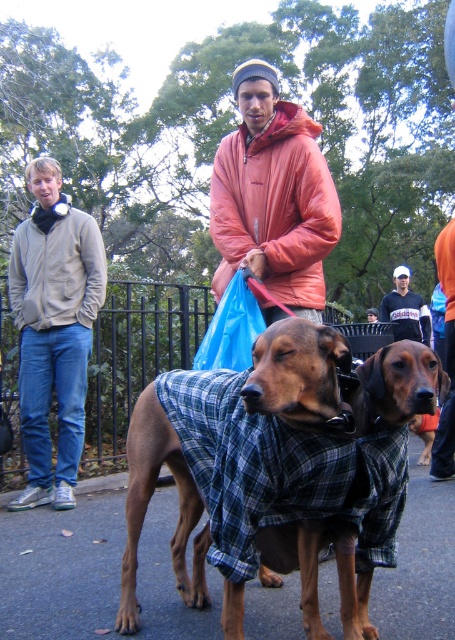
Question: Is brushed metal jacket at left thinner than black cotton shirt at center?

Choices:
 (A) yes
 (B) no

Answer: (A)

Question: Does matte gray hoodie at left appear on the right side of brown plaid coat at center?

Choices:
 (A) no
 (B) yes

Answer: (A)

Question: Which point is farther to the camera?

Choices:
 (A) black cotton shirt at center
 (B) orange puffy jacket at center
 (C) brushed metal jacket at left
 (D) matte gray hoodie at left

Answer: (A)

Question: Which object appears closest to the camera in this image?

Choices:
 (A) orange puffy jacket at center
 (B) black cotton shirt at center
 (C) brown plaid coat at center

Answer: (C)

Question: Is brown plaid coat at center in front of brushed metal jacket at left?

Choices:
 (A) no
 (B) yes

Answer: (B)

Question: Among these points, which one is farthest from the camera?

Choices:
 (A) (216, 246)
 (B) (397, 339)
 (C) (94, 250)
 (D) (298, 340)

Answer: (B)